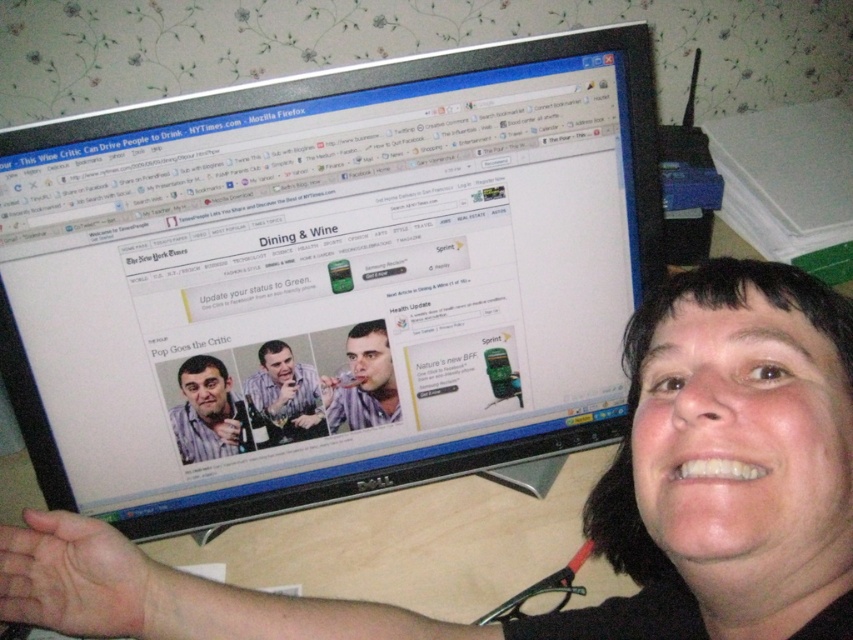
You are a photographer trying to capture a closeup shot of the black matte face at lower right and the matte white shirt at center. Based on their sizes in the image, which one do you think requires a wider angle lens to ensure it fits in the frame?

The black matte face at lower right might be wider than matte white shirt at center, so it likely requires a wider angle lens to fit in the frame.

Where is the striped shirt at center positioned in relation to the computer monitor?

The striped shirt at center is positioned at coordinates point (207, 412) relative to the computer monitor.

You are a delivery person who needs to place a package on the desk. The package is 12 inches wide. The desk has the black glossy monitor at upper center and the striped shirt at center on it. Can the package fit on the desk without overlapping either object?

The black glossy monitor at upper center is larger in size than the striped shirt at center. Since the monitor is larger, it occupies more space on the desk. However, without knowing the exact dimensions of the desk or the spacing between the objects, it is impossible to determine if the 12 inch package will fit without overlapping either object.